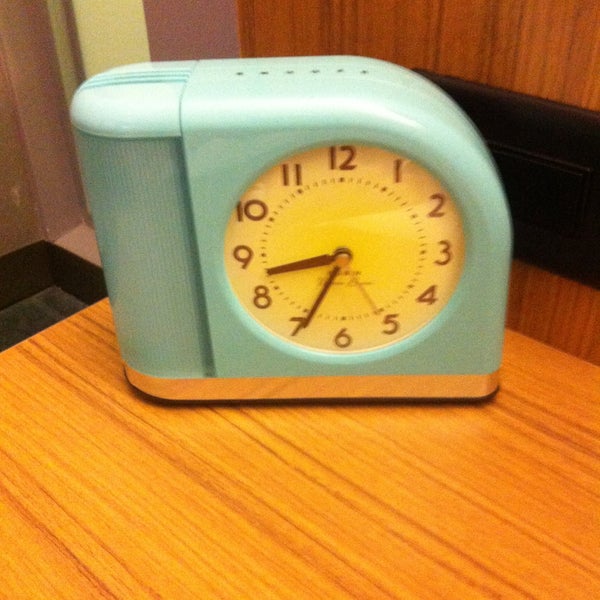
I want to click on clock hands, so click(x=291, y=267), click(x=321, y=298).